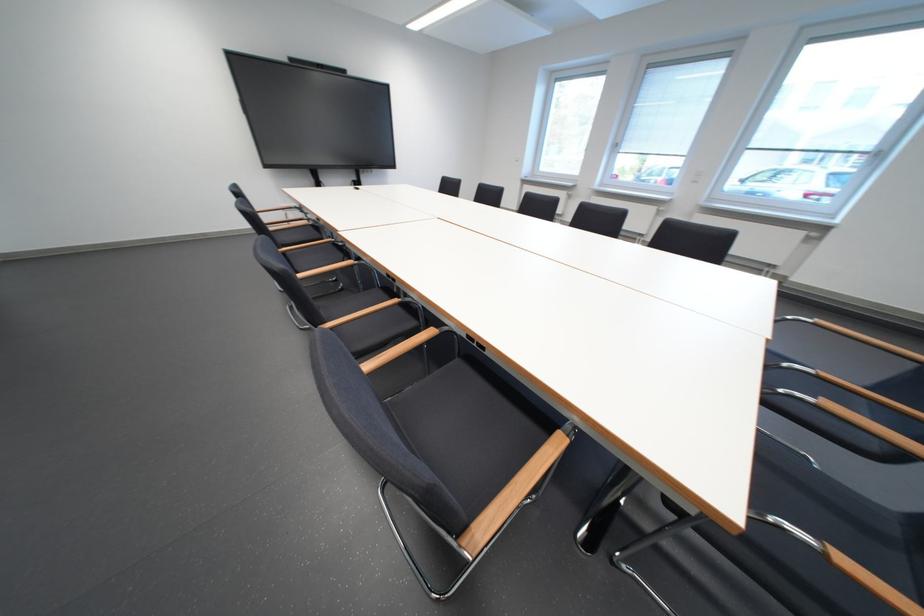
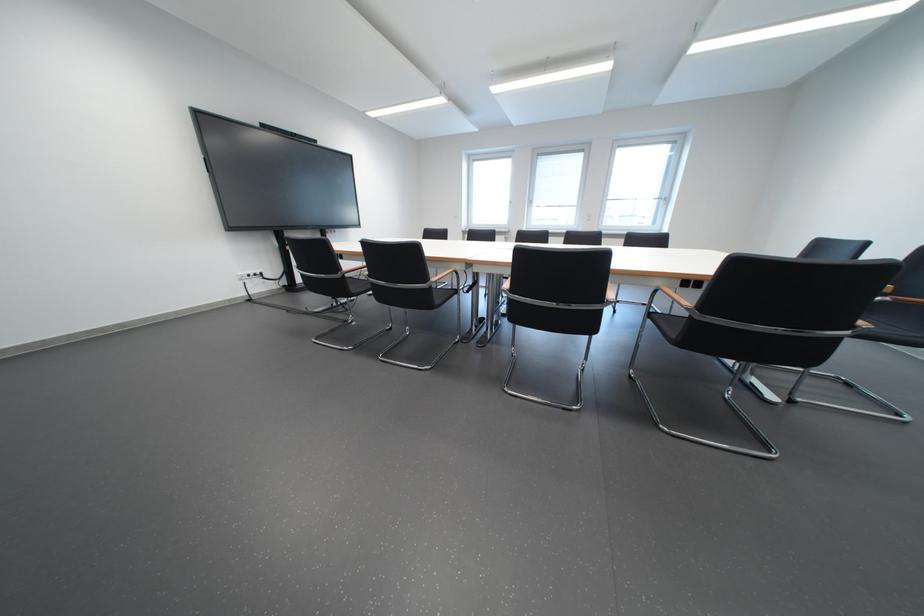
Question: Which direction would the cameraman need to move to produce the second image? Reply with the corresponding letter.

Choices:
 (A) Left
 (B) Right
 (C) Forward
 (D) Backward

Answer: (A)